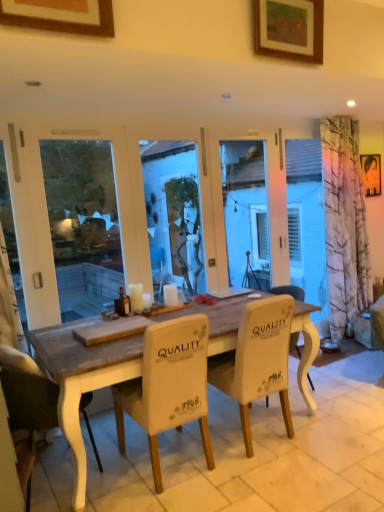
Where is `free space in front of white fabric chair at center, which is the first chair in right-to-left order`? This screenshot has width=384, height=512. free space in front of white fabric chair at center, which is the first chair in right-to-left order is located at coordinates (277, 482).